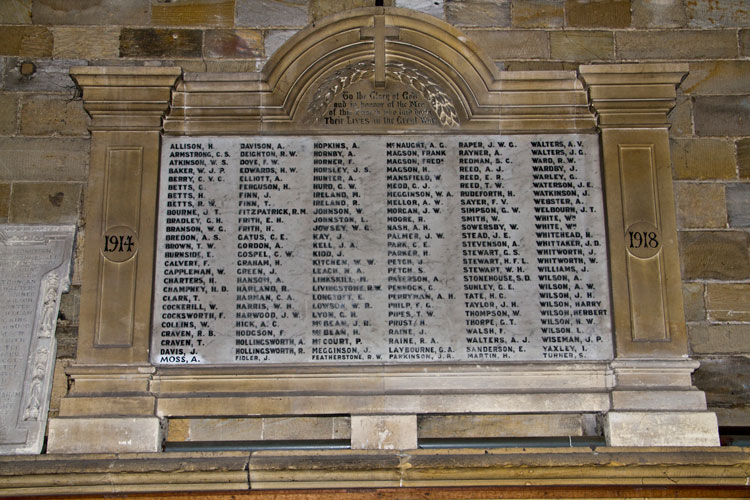
At what (x,y) coordinates should I click in order to perform the action: click on brick wall. Please return your answer as a coordinate pair (x, y). The image size is (750, 500). Looking at the image, I should click on (254, 428), (489, 428), (718, 202), (38, 110), (206, 28), (547, 40), (547, 269).